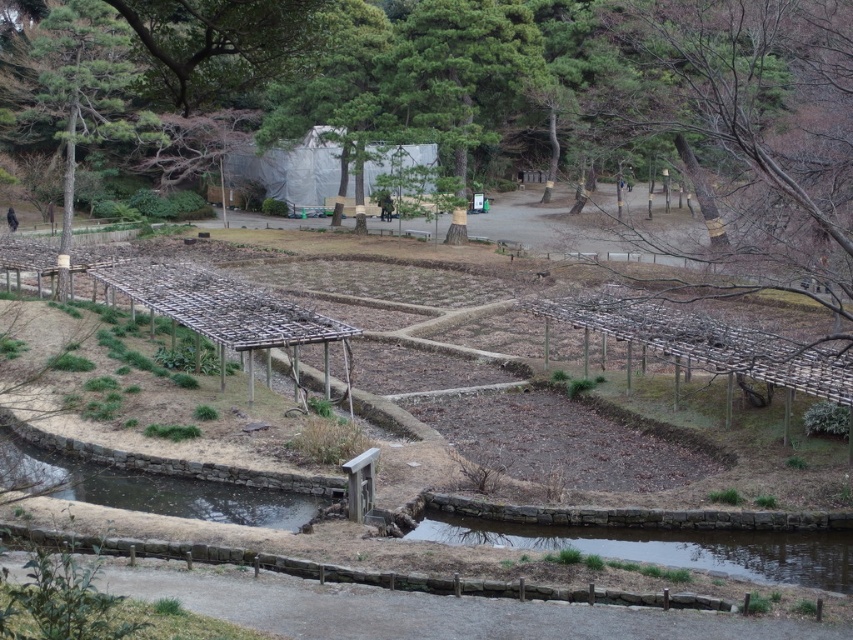
You are standing at the entrance of the garden and want to locate the brown wooden trellis at center. Based on the coordinates provided, in which direction should you walk from your current position to reach it?

The brown wooden trellis at center is located at coordinates point (752, 161). Since the coordinate system is not specified, it is recommended to consult a map or ask for further guidance to determine the exact direction to walk.

From the picture: You are a gardener planning to install a new trellis in the garden. You have a limited space that can only accommodate objects up to the size of the clear water at bottom left. Can the brown wooden trellis at center currently be placed in your available space?

The brown wooden trellis at center is larger in size than the clear water at bottom left, so it cannot be placed in the available space since it exceeds the size limit.